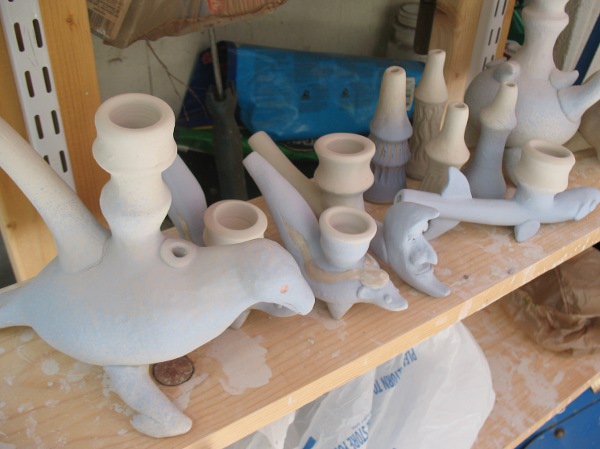
The height and width of the screenshot is (449, 600). I want to click on blue mat, so click(x=296, y=89).